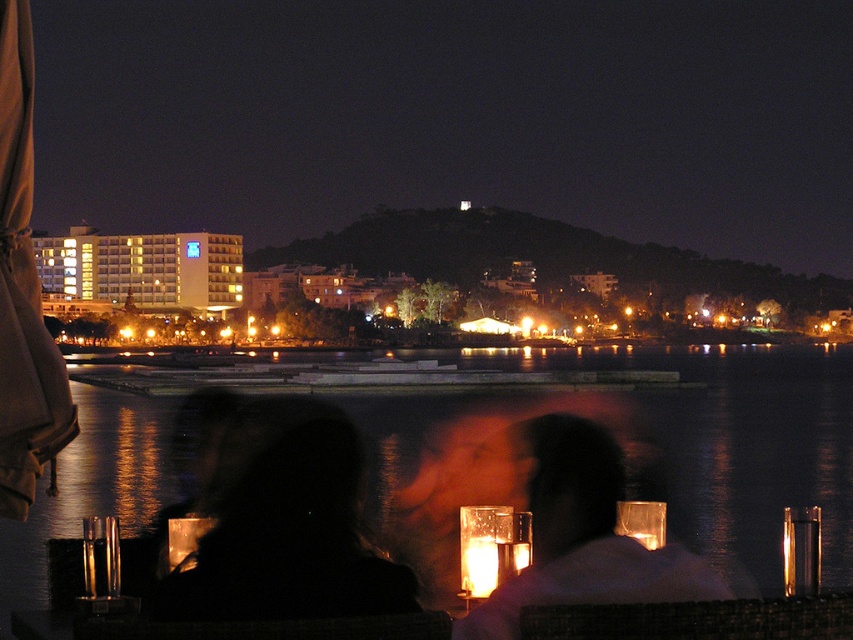
Is point (547, 579) farther from viewer compared to point (309, 600)?

Yes.

Between point (357, 460) and point (310, 532), which one is positioned behind?

The point (357, 460) is behind.

Does point (561, 532) come in front of point (260, 611)?

No, (561, 532) is further to viewer.

At what (x,y) coordinates should I click in order to perform the action: click on silhouette glass at lower center. Please return your answer as a coordinate pair (x, y). This screenshot has width=853, height=640. Looking at the image, I should click on (582, 536).